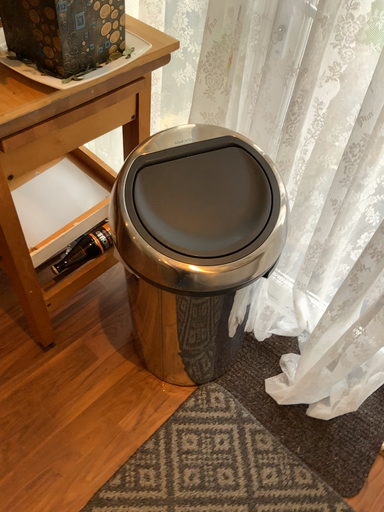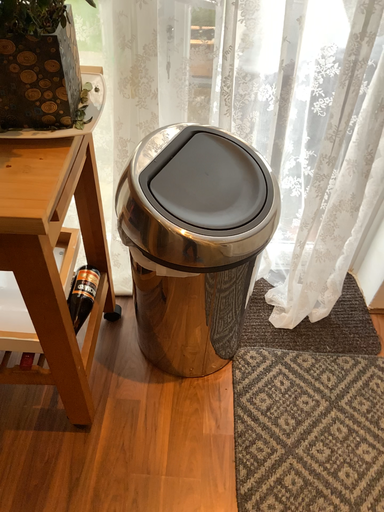
Question: Which way did the camera rotate in the video?

Choices:
 (A) rotated downward
 (B) rotated upward

Answer: (B)